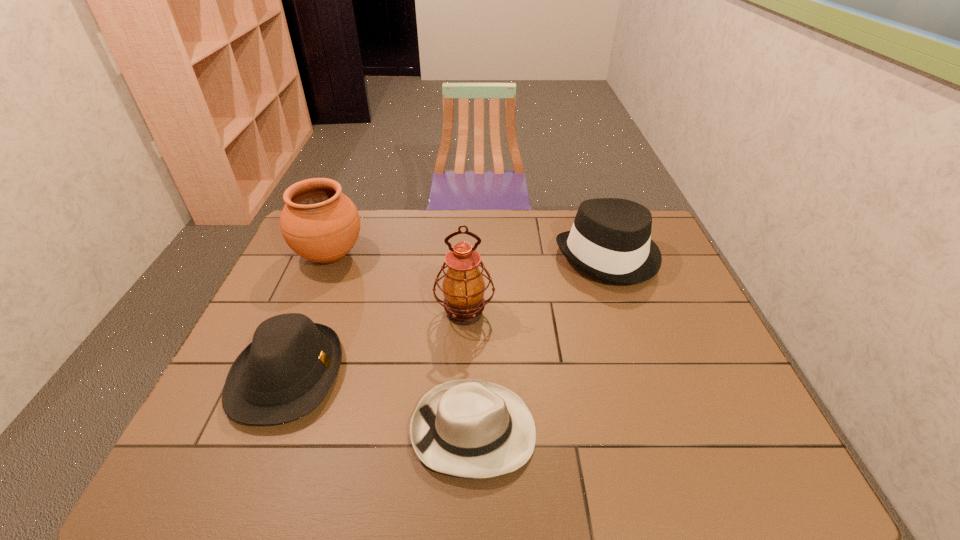
The width and height of the screenshot is (960, 540). Identify the location of vacant space that is in between the tallest object and the pottery. (397, 284).

Where is `vacant area that lies between the second tallest fedora and the second fedora from left to right`? The image size is (960, 540). vacant area that lies between the second tallest fedora and the second fedora from left to right is located at coordinates (381, 403).

Locate an element on the screen. This screenshot has width=960, height=540. empty location between the leftmost fedora and the oil lamp is located at coordinates (376, 344).

The image size is (960, 540). In order to click on free spot between the second shortest object and the tallest object in this screenshot , I will do `click(376, 344)`.

Select which object appears as the second closest to the rightmost fedora. Please provide its 2D coordinates. Your answer should be formatted as a tuple, i.e. [(x, y)], where the tuple contains the x and y coordinates of a point satisfying the conditions above.

[(469, 428)]

Identify which object is located as the second nearest to the rightmost object. Please provide its 2D coordinates. Your answer should be formatted as a tuple, i.e. [(x, y)], where the tuple contains the x and y coordinates of a point satisfying the conditions above.

[(469, 428)]

Point out which fedora is positioned as the second nearest to the leftmost fedora. Please provide its 2D coordinates. Your answer should be formatted as a tuple, i.e. [(x, y)], where the tuple contains the x and y coordinates of a point satisfying the conditions above.

[(610, 239)]

Identify which fedora is the closest to the oil lamp. Please provide its 2D coordinates. Your answer should be formatted as a tuple, i.e. [(x, y)], where the tuple contains the x and y coordinates of a point satisfying the conditions above.

[(469, 428)]

Where is `vacant space that satisfies the following two spatial constraints: 1. on the front side of the tallest object; 2. on the left side of the pottery`? vacant space that satisfies the following two spatial constraints: 1. on the front side of the tallest object; 2. on the left side of the pottery is located at coordinates (x=306, y=313).